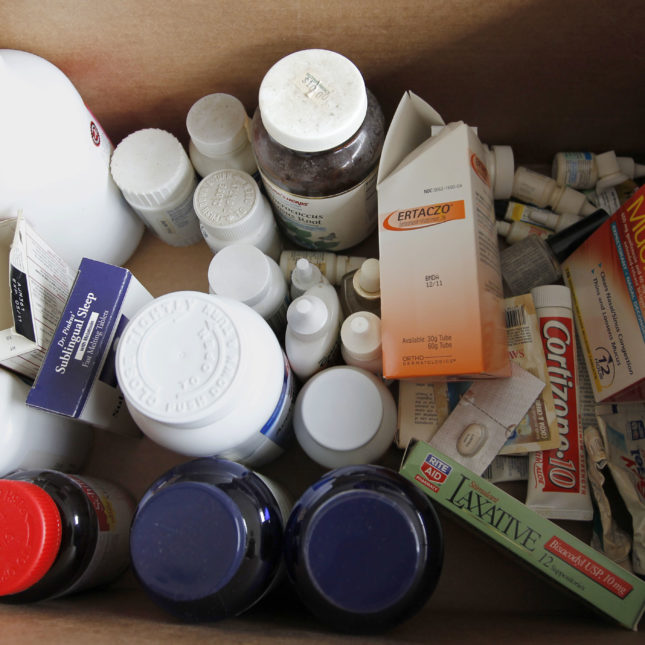
Locate an element on the screen. This screenshot has width=645, height=645. box is located at coordinates (448, 260), (599, 266), (491, 513), (90, 322), (25, 309).